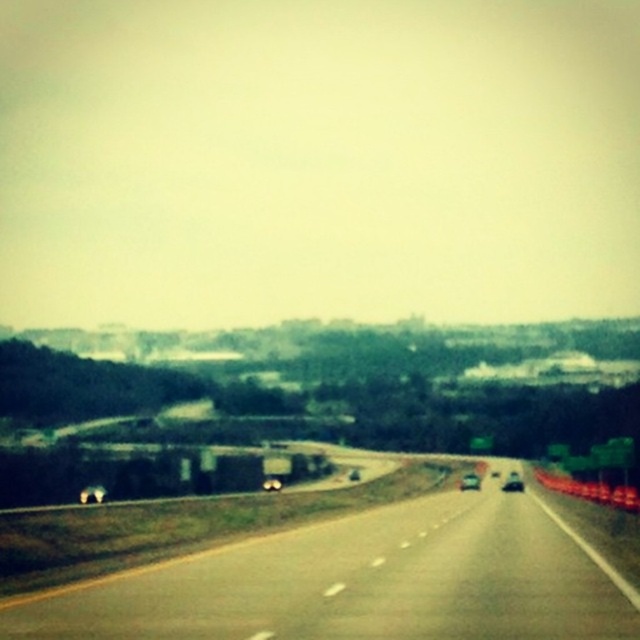
Question: Considering the relative positions of asphalt road at center and shiny silver sedan at center in the image provided, where is asphalt road at center located with respect to shiny silver sedan at center?

Choices:
 (A) below
 (B) above

Answer: (B)

Question: Which object is positioned closest to the black glossy car at center?

Choices:
 (A) asphalt road at center
 (B) shiny silver sedan at center

Answer: (B)

Question: Among these objects, which one is nearest to the camera?

Choices:
 (A) shiny silver sedan at center
 (B) black glossy car at center

Answer: (B)

Question: Does asphalt road at center appear over black glossy car at center?

Choices:
 (A) no
 (B) yes

Answer: (B)

Question: Which of the following is the farthest from the observer?

Choices:
 (A) black glossy car at center
 (B) shiny silver sedan at center

Answer: (B)

Question: From the image, what is the correct spatial relationship of asphalt road at center in relation to shiny silver sedan at center?

Choices:
 (A) right
 (B) left

Answer: (B)